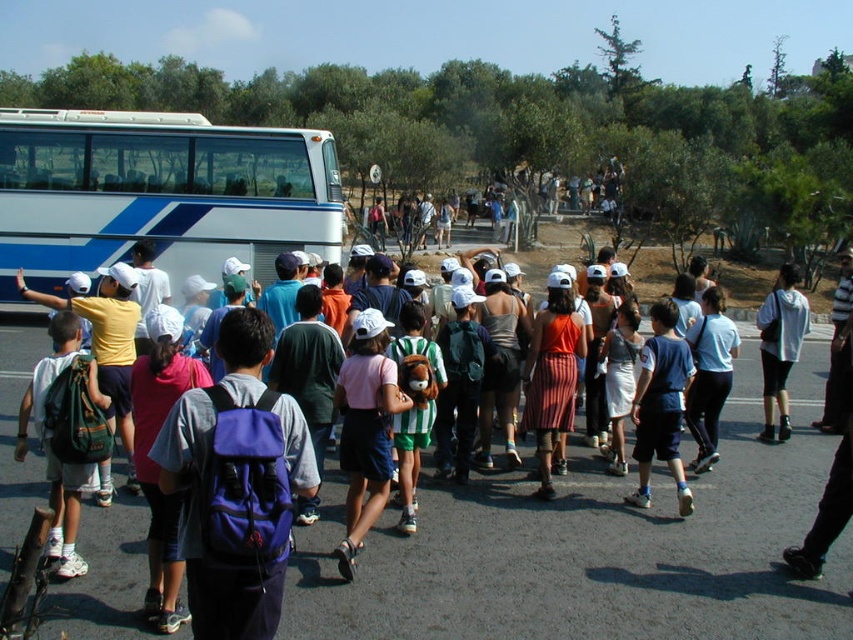
Question: Can you confirm if white glossy bus at left is positioned below purple fabric backpack at center?

Choices:
 (A) yes
 (B) no

Answer: (B)

Question: Which object appears closest to the camera in this image?

Choices:
 (A) pink fabric skirt at center
 (B) gray hoodie at center

Answer: (A)

Question: Does purple backpack at center appear on the left side of purple fabric backpack at center?

Choices:
 (A) yes
 (B) no

Answer: (A)

Question: Which point is closer to the camera?

Choices:
 (A) purple fabric backpack at center
 (B) matte green backpack at left

Answer: (A)

Question: Which object is closer to the camera taking this photo?

Choices:
 (A) purple fabric backpack at center
 (B) multicolored striped shirts at center
 (C) blue fabric shorts at center
 (D) pink fabric skirt at center

Answer: (A)

Question: Does white glossy bus at left appear on the right side of white cotton shirt at center?

Choices:
 (A) yes
 (B) no

Answer: (B)